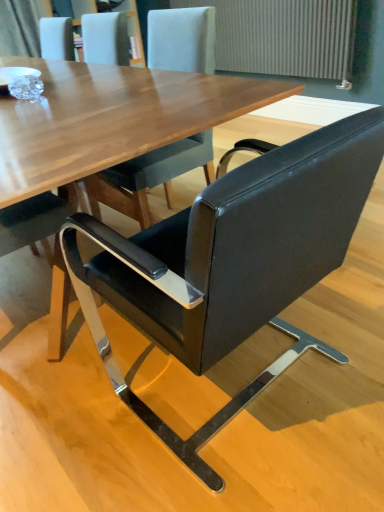
Question: Is gray textured radiator at upper right beside black leather chair at center?

Choices:
 (A) no
 (B) yes

Answer: (A)

Question: Is gray textured radiator at upper right thinner than black leather chair at center?

Choices:
 (A) no
 (B) yes

Answer: (B)

Question: Is gray textured radiator at upper right shorter than black leather chair at center?

Choices:
 (A) yes
 (B) no

Answer: (B)

Question: From the image's perspective, is gray textured radiator at upper right beneath black leather chair at center?

Choices:
 (A) yes
 (B) no

Answer: (B)

Question: Considering the relative sizes of gray textured radiator at upper right and black leather chair at center in the image provided, is gray textured radiator at upper right taller than black leather chair at center?

Choices:
 (A) no
 (B) yes

Answer: (B)

Question: From a real-world perspective, is gray textured radiator at upper right over black leather chair at center?

Choices:
 (A) no
 (B) yes

Answer: (B)

Question: Is black leather chair at center in front of gray textured radiator at upper right?

Choices:
 (A) yes
 (B) no

Answer: (A)

Question: Can you confirm if black leather chair at center is shorter than gray textured radiator at upper right?

Choices:
 (A) yes
 (B) no

Answer: (A)

Question: From a real-world perspective, is black leather chair at center positioned over gray textured radiator at upper right based on gravity?

Choices:
 (A) no
 (B) yes

Answer: (A)

Question: Is black leather chair at center next to gray textured radiator at upper right and touching it?

Choices:
 (A) yes
 (B) no

Answer: (B)

Question: Is black leather chair at center further to the viewer compared to gray textured radiator at upper right?

Choices:
 (A) no
 (B) yes

Answer: (A)

Question: Is black leather chair at center looking in the opposite direction of gray textured radiator at upper right?

Choices:
 (A) no
 (B) yes

Answer: (A)

Question: In terms of width, does gray textured radiator at upper right look wider or thinner when compared to black leather chair at center?

Choices:
 (A) wide
 (B) thin

Answer: (B)